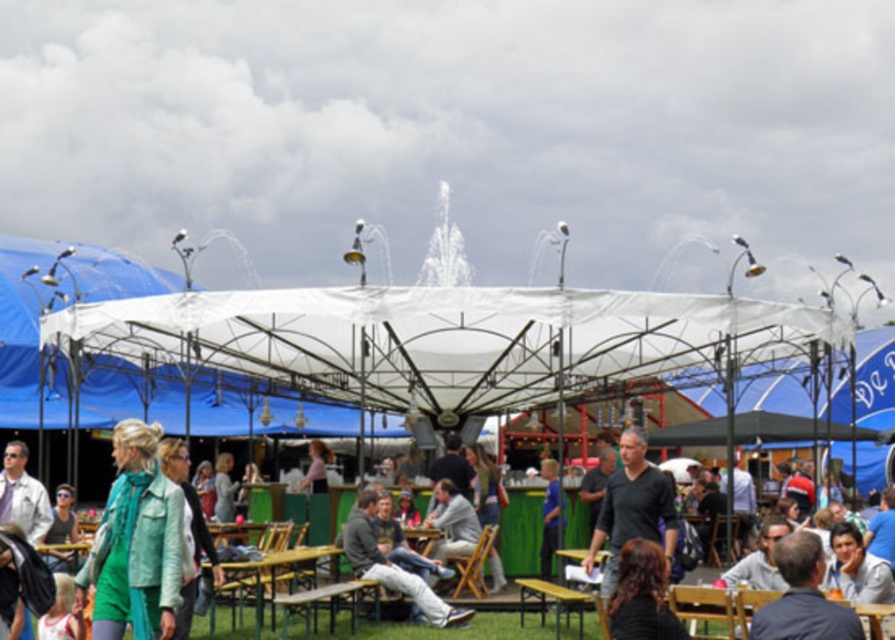
Question: Estimate the real-world distances between objects in this image. Which object is farther from the gray fabric jacket at lower right?

Choices:
 (A) matte gray jacket at center
 (B) green fabric jacket at center
 (C) black matte shirt at center
 (D) green matte jacket at lower left

Answer: (D)

Question: Does white fabric canopy at upper center appear on the right side of green fabric jacket at center?

Choices:
 (A) no
 (B) yes

Answer: (A)

Question: Which point is closer to the camera taking this photo?

Choices:
 (A) (800, 548)
 (B) (307, 560)
 (C) (66, 410)
 (D) (162, 564)

Answer: (A)

Question: Can you confirm if white fabric canopy at upper center is positioned to the left of green matte jacket at lower left?

Choices:
 (A) no
 (B) yes

Answer: (B)

Question: Which object is positioned farthest from the green matte jacket at lower left?

Choices:
 (A) black matte shirt at center
 (B) white fabric canopy at upper center
 (C) matte gray jacket at center

Answer: (B)

Question: Is green matte jacket at lower left to the right of matte gray jacket at center from the viewer's perspective?

Choices:
 (A) no
 (B) yes

Answer: (A)